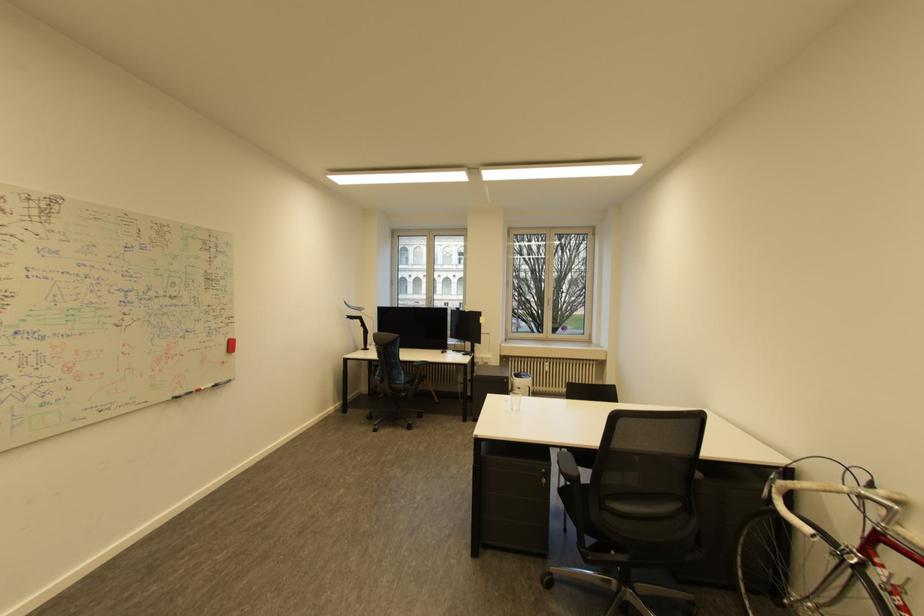
This screenshot has height=616, width=924. What are the coordinates of `black chair armrest` in the screenshot? It's located at (568, 471).